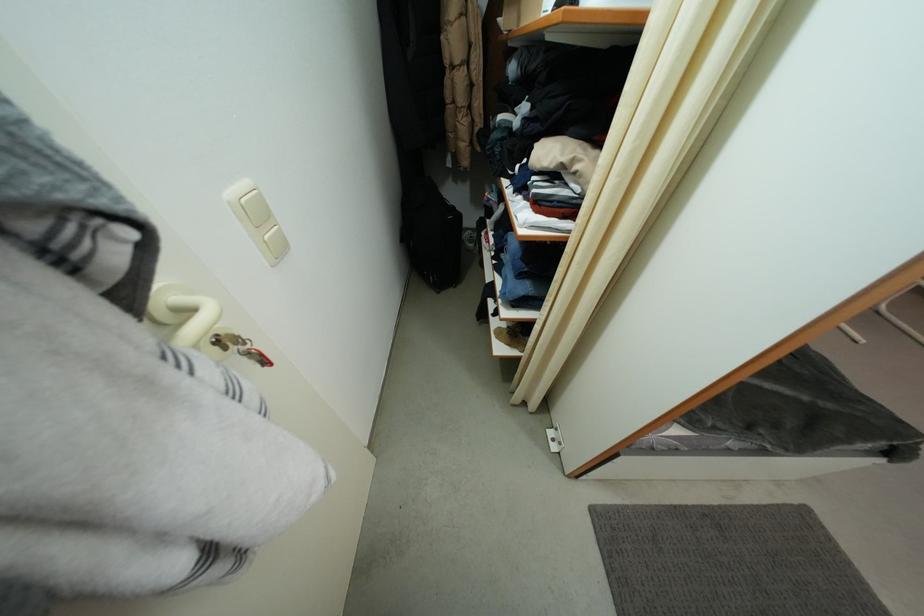
Find where to push the light switch button. Please return your answer as a coordinate pair (x, y).

(263, 224)